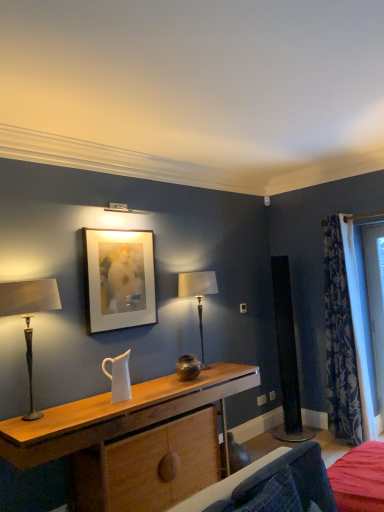
Identify the location of free space above wooden desk at center (from a real-world perspective). The height and width of the screenshot is (512, 384). pos(134,396).